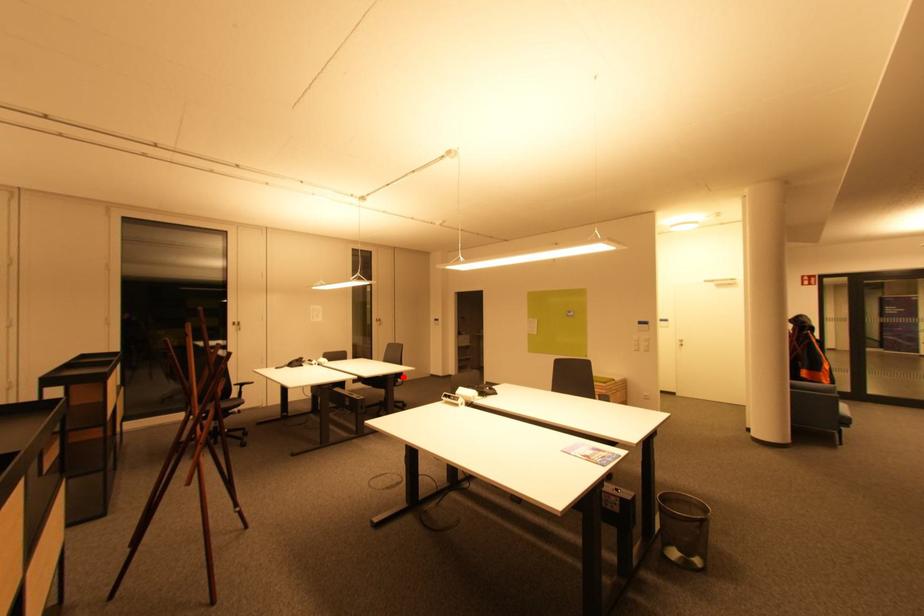
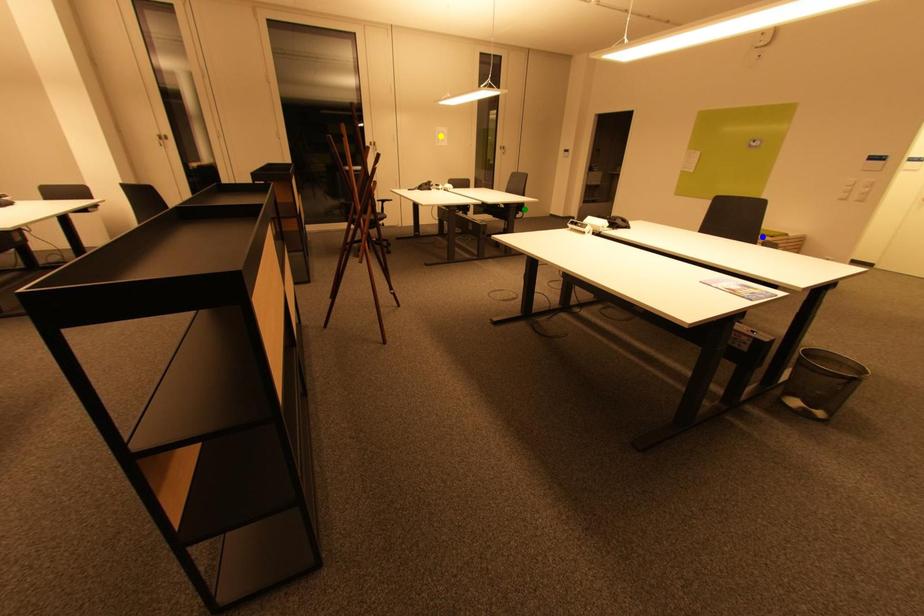
Question: I am providing you with two images of the same scene from different viewpoints. A red point is marked on the first image. You are given multiple points on the second image. In image 2, which mark is for the same physical point as the one in image 1?

Choices:
 (A) yellow point
 (B) green point
 (C) blue point

Answer: (B)